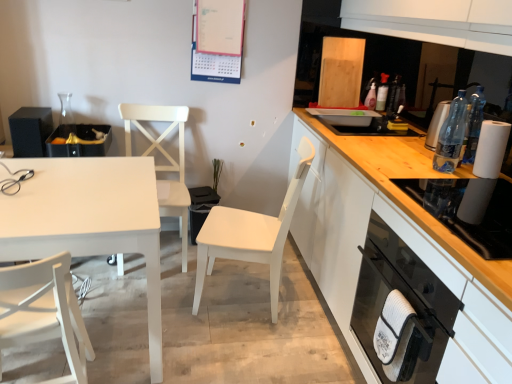
Identify the location of vacant space underneath white matte chair at center, positioned as the 2th chair in front-to-back order (from a real-world perspective). point(251,293).